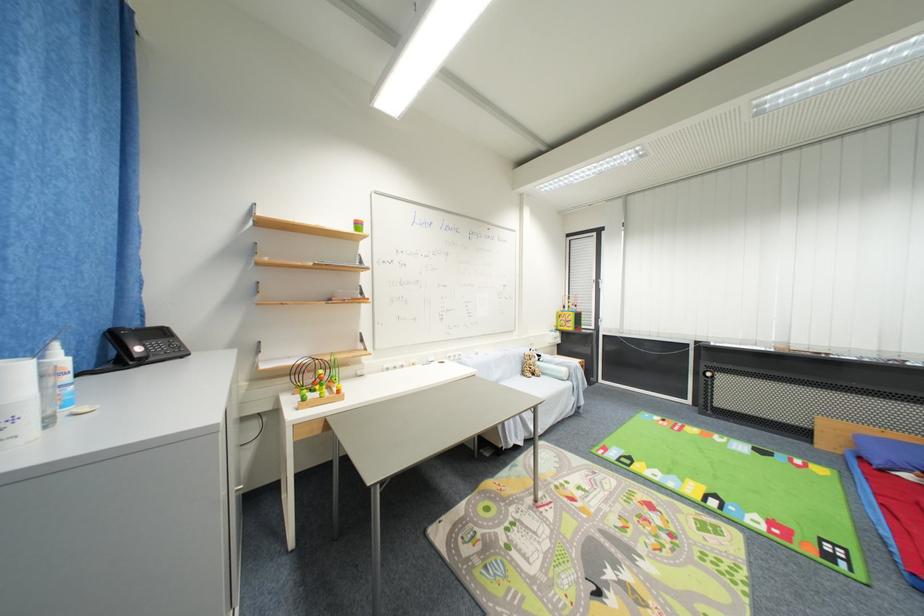
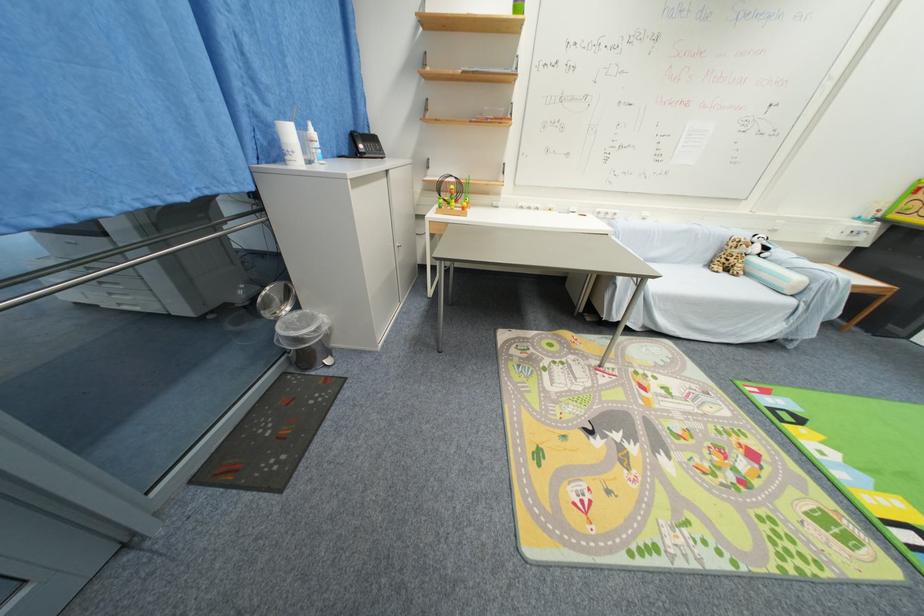
In the second image, find the point that corresponds to pixel 540 379 in the first image.

(730, 276)